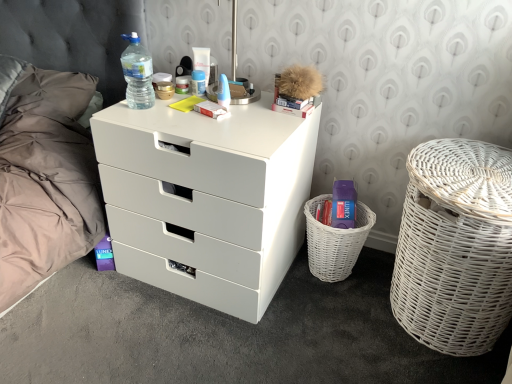
Question: Is the position of white wicker basket at right more distant than that of translucent plastic bottle at upper left?

Choices:
 (A) no
 (B) yes

Answer: (A)

Question: Considering the relative positions of white wicker basket at right and translucent plastic bottle at upper left in the image provided, is white wicker basket at right in front of translucent plastic bottle at upper left?

Choices:
 (A) no
 (B) yes

Answer: (B)

Question: Can translucent plastic bottle at upper left be found inside white wicker basket at right?

Choices:
 (A) no
 (B) yes

Answer: (A)

Question: Considering the relative sizes of white wicker basket at right and translucent plastic bottle at upper left in the image provided, is white wicker basket at right smaller than translucent plastic bottle at upper left?

Choices:
 (A) yes
 (B) no

Answer: (B)

Question: Is translucent plastic bottle at upper left at the back of white wicker basket at right?

Choices:
 (A) yes
 (B) no

Answer: (B)

Question: From the image's perspective, is translucent plastic bottle at upper left above or below blue plastic toothbrush at upper center, the fourth toiletry when ordered from left to right?

Choices:
 (A) above
 (B) below

Answer: (A)

Question: Based on their sizes in the image, would you say translucent plastic bottle at upper left is bigger or smaller than blue plastic toothbrush at upper center, the 1th toiletry when ordered from right to left?

Choices:
 (A) small
 (B) big

Answer: (B)

Question: In terms of width, does translucent plastic bottle at upper left look wider or thinner when compared to blue plastic toothbrush at upper center, the fourth toiletry when ordered from left to right?

Choices:
 (A) thin
 (B) wide

Answer: (B)

Question: Would you say translucent plastic bottle at upper left is inside or outside blue plastic toothbrush at upper center, the 1th toiletry when ordered from right to left?

Choices:
 (A) inside
 (B) outside

Answer: (B)

Question: In the image, is blue plastic toothbrush at upper center, the fourth toiletry when ordered from left to right, positioned in front of or behind white wicker basket at right?

Choices:
 (A) behind
 (B) front

Answer: (A)

Question: Is blue plastic toothbrush at upper center, the 1th toiletry when ordered from right to left, spatially inside white wicker basket at right, or outside of it?

Choices:
 (A) outside
 (B) inside

Answer: (A)

Question: From a real-world perspective, is blue plastic toothbrush at upper center, the fourth toiletry when ordered from left to right, above or below white wicker basket at right?

Choices:
 (A) below
 (B) above

Answer: (B)

Question: In terms of size, does blue plastic toothbrush at upper center, the 1th toiletry when ordered from right to left, appear bigger or smaller than white wicker basket at right?

Choices:
 (A) small
 (B) big

Answer: (A)

Question: In terms of height, does white plastic tube at upper center, the 3th toiletry positioned from the left, look taller or shorter compared to blue plastic toothbrush at upper center, the fourth toiletry when ordered from left to right?

Choices:
 (A) tall
 (B) short

Answer: (A)

Question: Is white plastic tube at upper center, the second toiletry from the right, in front of or behind blue plastic toothbrush at upper center, the fourth toiletry when ordered from left to right, in the image?

Choices:
 (A) behind
 (B) front

Answer: (A)